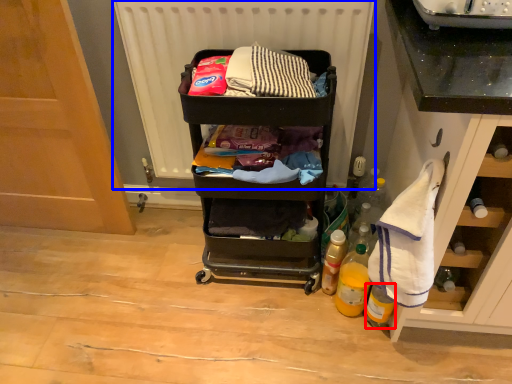
Question: Which of the following is the closest to the observer, bottle (highlighted by a red box) or radiator (highlighted by a blue box)?

Choices:
 (A) bottle
 (B) radiator

Answer: (B)